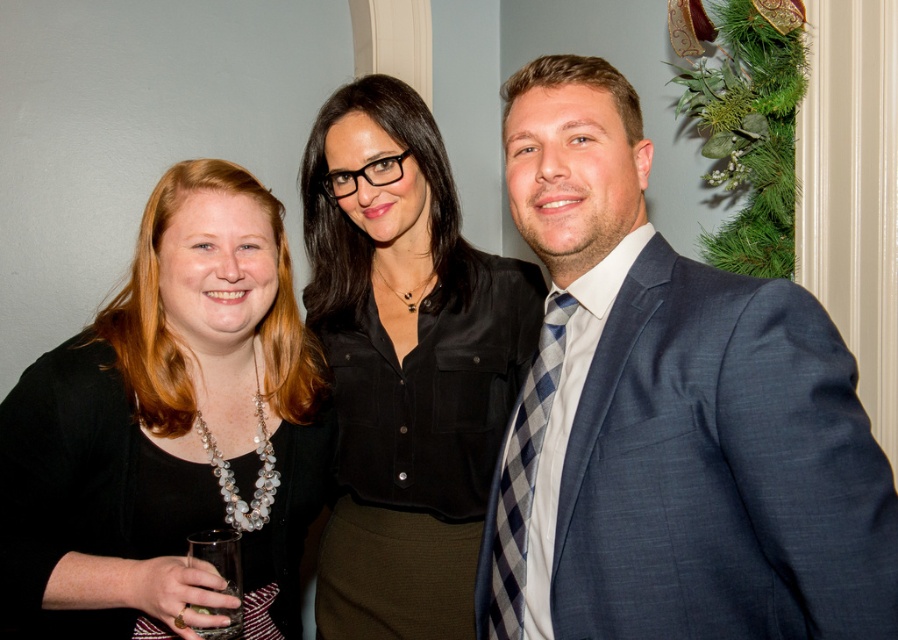
You are at a party and want to take a photo with the blue textured suit at center and the blue plaid tie at right. Which one is on the left side?

The blue plaid tie at right is on the left side because the blue textured suit at center is positioned to its right.